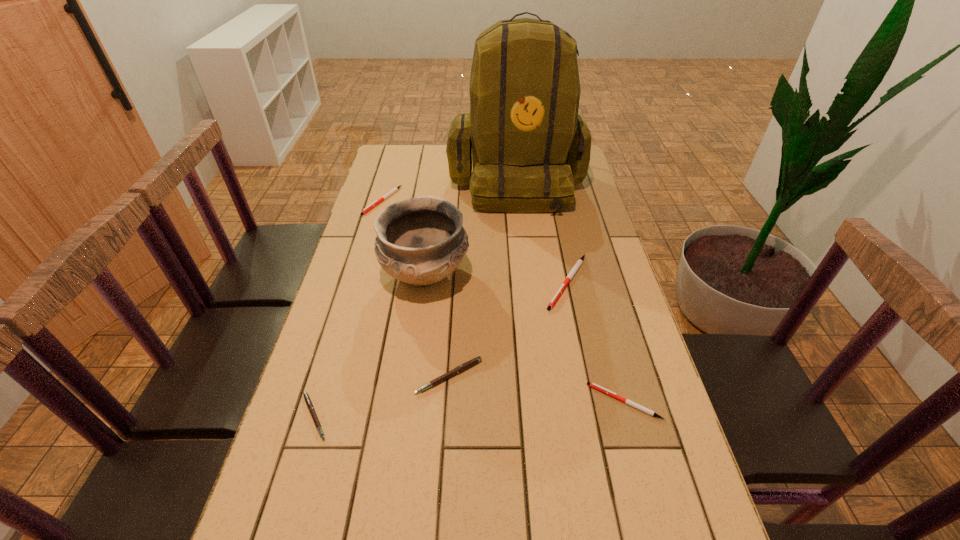
At what (x,y) coordinates should I click in order to perform the action: click on vacant space in between the smallest white pen and the second biggest white pen. Please return your answer as a coordinate pair (x, y). This screenshot has height=540, width=960. Looking at the image, I should click on (503, 301).

I want to click on free space between the smallest white pen and the smaller pink pen, so click(x=469, y=409).

Identify which object is located as the second nearest to the second biggest white pen. Please provide its 2D coordinates. Your answer should be formatted as a tuple, i.e. [(x, y)], where the tuple contains the x and y coordinates of a point satisfying the conditions above.

[(529, 147)]

Where is `the sixth closest object to the pottery`? The width and height of the screenshot is (960, 540). the sixth closest object to the pottery is located at coordinates (593, 385).

Choose which pen is the second nearest neighbor to the nearest white pen. Please provide its 2D coordinates. Your answer should be formatted as a tuple, i.e. [(x, y)], where the tuple contains the x and y coordinates of a point satisfying the conditions above.

[(470, 363)]

Identify the location of pen that stands as the closest to the bigger pink pen. The image size is (960, 540). (308, 401).

Identify the location of white pen that stands as the second closest to the sixth shortest object. (580, 261).

You are a GUI agent. You are given a task and a screenshot of the screen. Output one action in this format:
    pyautogui.click(x=<x>, y=<y>)
    Task: Click on the white pen that is the third closest to the smaller pink pen
    
    Given the screenshot: What is the action you would take?
    pyautogui.click(x=395, y=189)

What are the coordinates of `free space that satisfies the following two spatial constraints: 1. on the clicker of the leftmost white pen; 2. on the left side of the second tallest object` in the screenshot? It's located at (361, 274).

The width and height of the screenshot is (960, 540). Identify the location of free space that satisfies the following two spatial constraints: 1. at the nib of the bigger pink pen; 2. at the nib of the left pink pen. (446, 416).